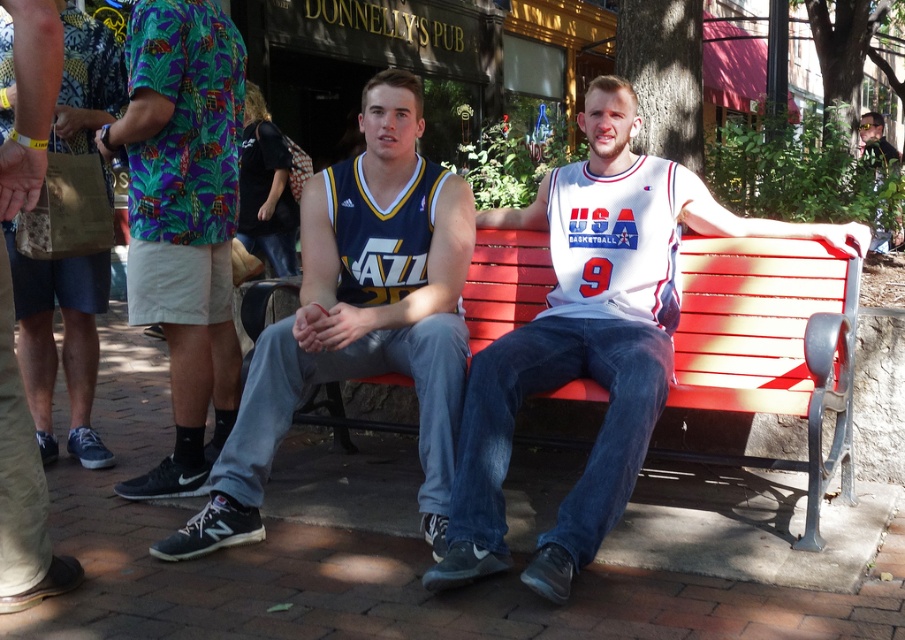
Question: Which object is closer to the camera taking this photo?

Choices:
 (A) matte black tank top at upper right
 (B) red painted wood bench at center
 (C) khaki shorts at center

Answer: (C)

Question: Does blue jersey at center appear on the right side of khaki shorts at center?

Choices:
 (A) no
 (B) yes

Answer: (B)

Question: Among these points, which one is farthest from the camera?

Choices:
 (A) (494, 420)
 (B) (884, 234)
 (C) (414, 292)

Answer: (B)

Question: Which point is closer to the camera taking this photo?

Choices:
 (A) (503, 358)
 (B) (251, 449)
 (C) (880, 157)
 (D) (164, 294)

Answer: (A)

Question: Does khaki shorts at center lie behind matte black tank top at upper right?

Choices:
 (A) yes
 (B) no

Answer: (B)

Question: Considering the relative positions of white jersey at center and red painted wood bench at center in the image provided, where is white jersey at center located with respect to red painted wood bench at center?

Choices:
 (A) below
 (B) above

Answer: (B)